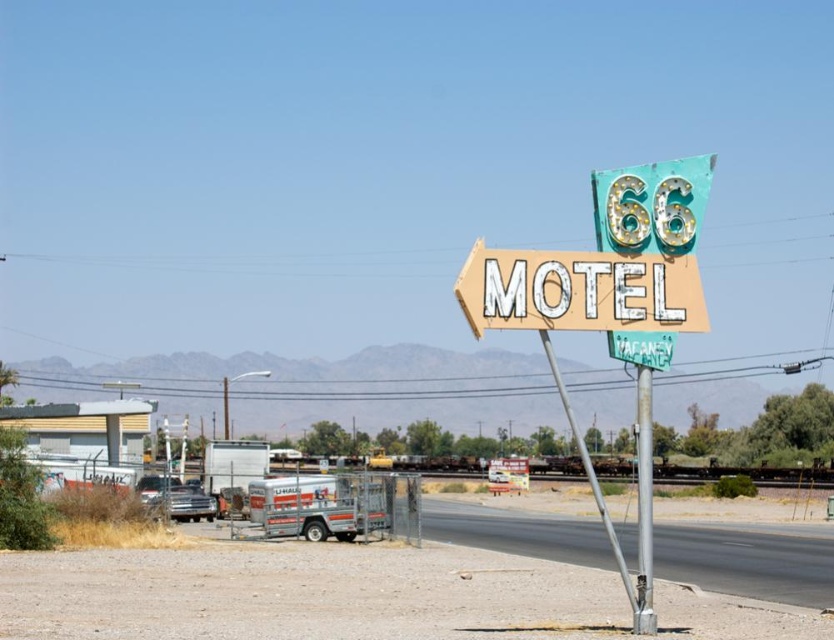
You are a traveler driving along the road and see the metallic pole at center and the green neon motel sign at center. Which object is located to the right of the other?

The metallic pole at center is positioned on the right side of green neon motel sign at center, so the metallic pole at center is to the right of the green neon motel sign at center.

You are a photographer planning to capture the Route 66 Motel sign and its surroundings. You want to ensure both the metallic pole at center and the green neon motel sign at center are clearly visible in your shot. Based on their sizes, which object should you focus on first to frame the scene properly?

The metallic pole at center has a greater height compared to the green neon motel sign at center, so you should focus on framing the metallic pole at center first to ensure it fits within the shot while still capturing the green neon motel sign at center appropriately.

You are driving along the road and see the vintage neon motel sign at center and the metallic pole at center. Which object is closer to your car?

The vintage neon motel sign at center is closer to your car because it is further to the viewer than the metallic pole at center.